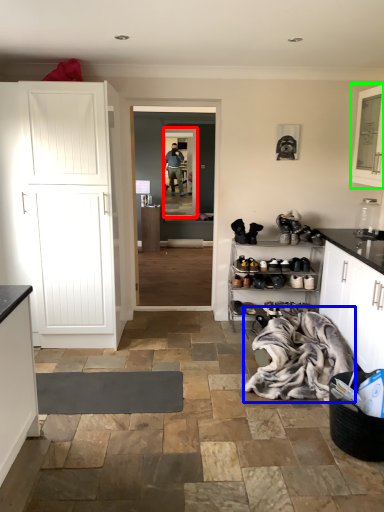
Question: Which object is positioned closest to glass door (highlighted by a red box)? Select from laundry (highlighted by a blue box) and cabinetry (highlighted by a green box).

Choices:
 (A) laundry
 (B) cabinetry

Answer: (B)